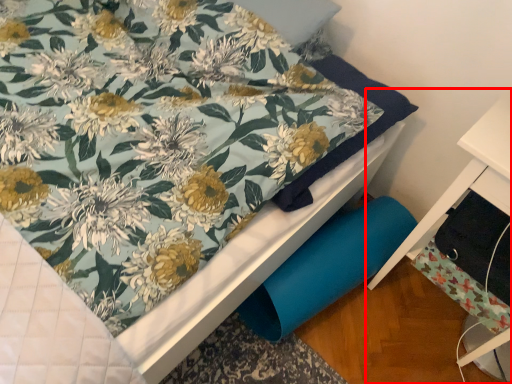
Question: Observing the image, what is the correct spatial positioning of furniture (annotated by the red box) in reference to drawer?

Choices:
 (A) left
 (B) right

Answer: (B)